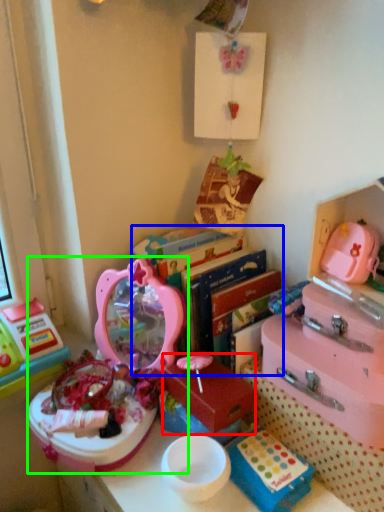
Question: Which object is positioned farthest from storage box (highlighted by a red box)? Select from bookshelf (highlighted by a blue box) and toy (highlighted by a green box).

Choices:
 (A) bookshelf
 (B) toy

Answer: (B)